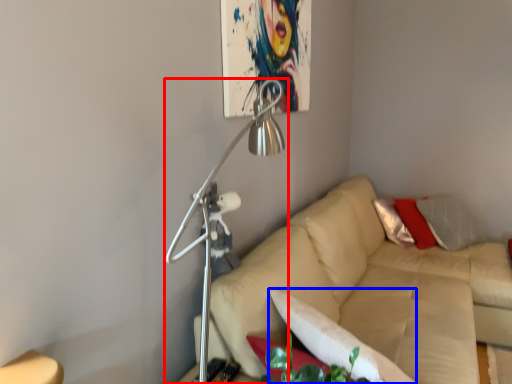
Question: Which object appears farthest to the camera in this image, lamp (highlighted by a red box) or pillow (highlighted by a blue box)?

Choices:
 (A) lamp
 (B) pillow

Answer: (B)